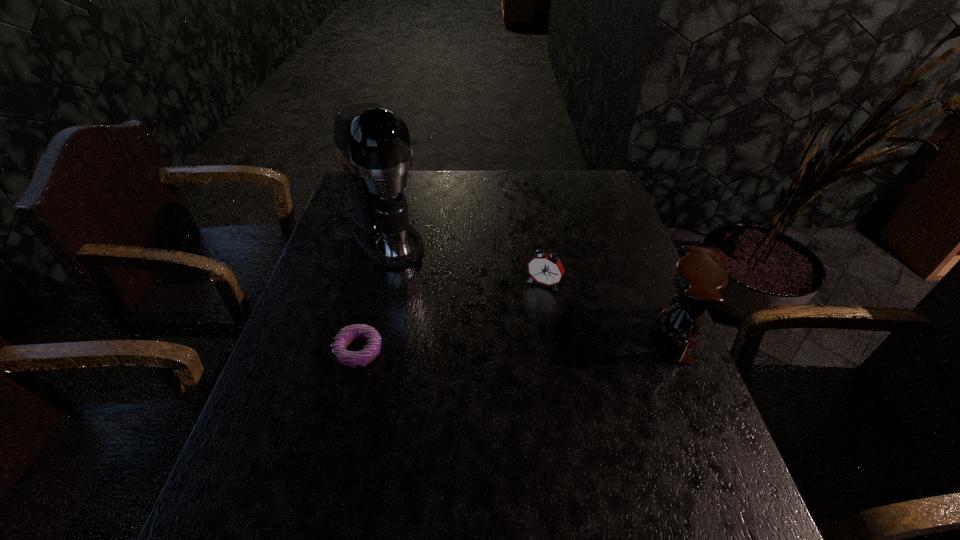
The height and width of the screenshot is (540, 960). Find the location of `vacant region between the hourglass and the second shortest object`. vacant region between the hourglass and the second shortest object is located at coordinates (609, 310).

Locate an element on the screen. The width and height of the screenshot is (960, 540). free space between the second farthest object and the hourglass is located at coordinates (609, 310).

Choose which object is the nearest neighbor to the farthest object. Please provide its 2D coordinates. Your answer should be formatted as a tuple, i.e. [(x, y)], where the tuple contains the x and y coordinates of a point satisfying the conditions above.

[(349, 359)]

At what (x,y) coordinates should I click in order to perform the action: click on object that is the closest to the hourglass. Please return your answer as a coordinate pair (x, y). This screenshot has height=540, width=960. Looking at the image, I should click on (545, 269).

Locate an element on the screen. vacant region that satisfies the following two spatial constraints: 1. on the back side of the shortest object; 2. on the right side of the third nearest object is located at coordinates (374, 285).